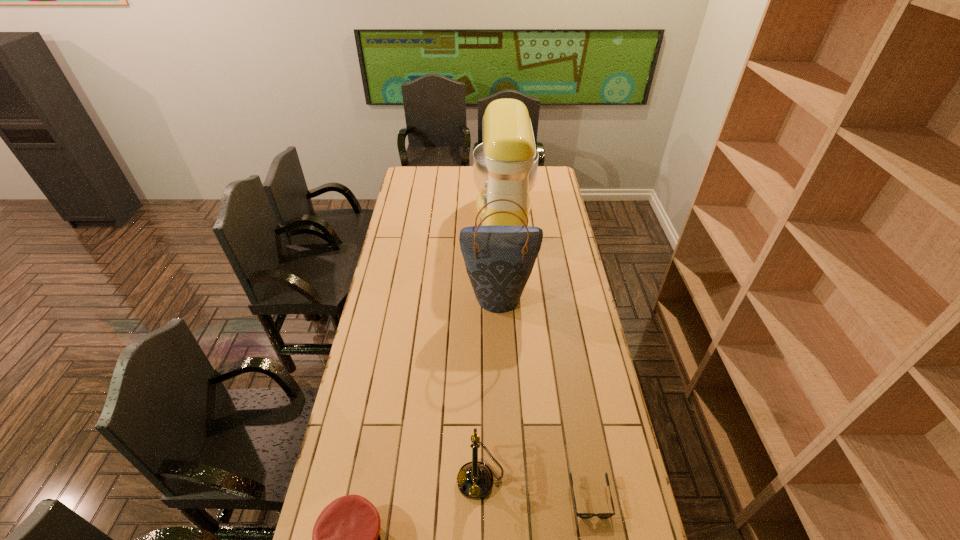
Where is `vacant area that lies between the mixer and the shortest object`? The width and height of the screenshot is (960, 540). vacant area that lies between the mixer and the shortest object is located at coordinates (547, 358).

Where is `free point between the third shortest object and the tallest object`? The image size is (960, 540). free point between the third shortest object and the tallest object is located at coordinates (492, 348).

You are a GUI agent. You are given a task and a screenshot of the screen. Output one action in this format:
    pyautogui.click(x=<x>, y=<y>)
    Task: Click on the vacant region between the shortest object and the second farthest object
    The width and height of the screenshot is (960, 540).
    Given the screenshot: What is the action you would take?
    pyautogui.click(x=544, y=397)

Where is `free space between the sunglasses and the tallest object`? The image size is (960, 540). free space between the sunglasses and the tallest object is located at coordinates (547, 358).

Select which object is the closest to the sunglasses. Please provide its 2D coordinates. Your answer should be formatted as a tuple, i.e. [(x, y)], where the tuple contains the x and y coordinates of a point satisfying the conditions above.

[(475, 479)]

Find the location of `object that is the nearest to the sunglasses`. object that is the nearest to the sunglasses is located at coordinates (475, 479).

This screenshot has width=960, height=540. What are the coordinates of `free spot that satisfies the following two spatial constraints: 1. on the side of the farthest object with the control knob; 2. on the front side of the fourth nearest object` in the screenshot? It's located at (510, 295).